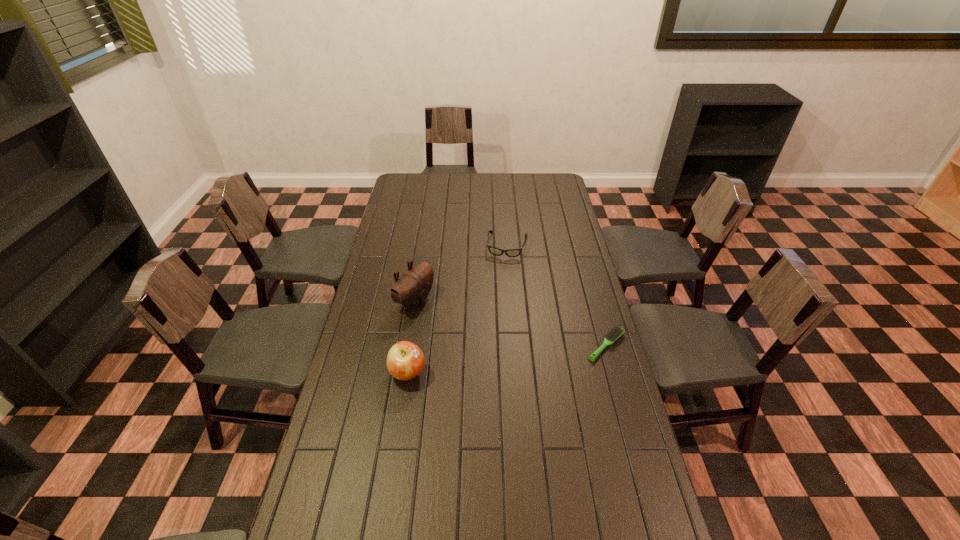
At what (x,y) coordinates should I click in order to perform the action: click on vacant space at the right edge. Please return your answer as a coordinate pair (x, y). The image size is (960, 540). Looking at the image, I should click on (552, 219).

Image resolution: width=960 pixels, height=540 pixels. In the image, there is a desktop. In order to click on free region at the far left corner in this screenshot , I will do `click(397, 193)`.

This screenshot has width=960, height=540. In order to click on blank space at the near left corner in this screenshot , I will do `click(336, 534)`.

Find the location of a particular element. Image resolution: width=960 pixels, height=540 pixels. vacant area at the far right corner is located at coordinates (540, 184).

This screenshot has width=960, height=540. I want to click on empty space that is in between the shortest object and the second farthest object, so click(x=511, y=323).

Locate an element on the screen. The image size is (960, 540). blank region between the shortest object and the apple is located at coordinates (507, 359).

In order to click on free space between the third shortest object and the pouch in this screenshot , I will do `click(412, 338)`.

The width and height of the screenshot is (960, 540). Find the location of `free point between the shortest object and the apple`. free point between the shortest object and the apple is located at coordinates (507, 359).

At what (x,y) coordinates should I click in order to perform the action: click on blank region between the apple and the hairbrush. Please return your answer as a coordinate pair (x, y). Looking at the image, I should click on (507, 359).

At what (x,y) coordinates should I click in order to perform the action: click on empty space that is in between the second tallest object and the rightmost object. Please return your answer as a coordinate pair (x, y). The height and width of the screenshot is (540, 960). Looking at the image, I should click on (507, 359).